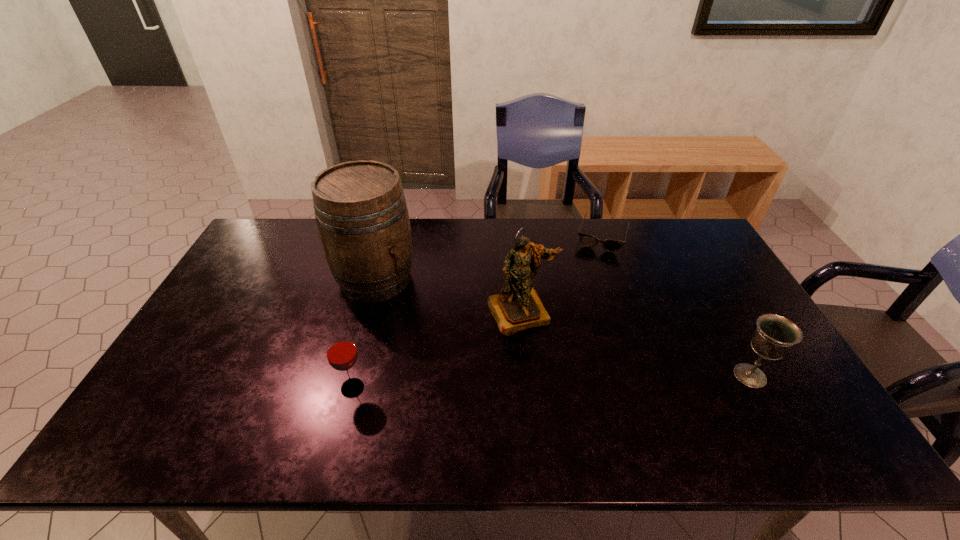
You are a GUI agent. You are given a task and a screenshot of the screen. Output one action in this format:
    pyautogui.click(x=<x>, y=<y>)
    Task: Click on the free space that satisfies the following two spatial constraints: 1. on the back side of the tallest object; 2. on the left side of the sunglasses
    The height and width of the screenshot is (540, 960).
    Given the screenshot: What is the action you would take?
    pyautogui.click(x=387, y=237)

I want to click on vacant position in the image that satisfies the following two spatial constraints: 1. on the front side of the shortest object; 2. on the right side of the rightmost object, so click(x=652, y=376).